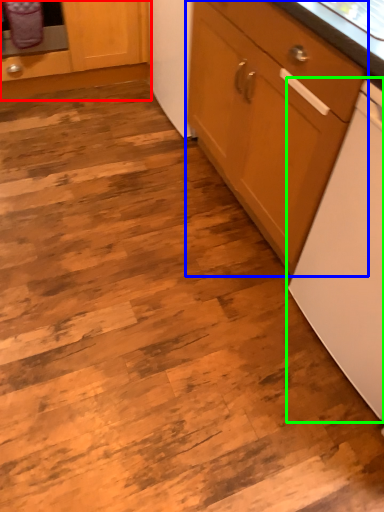
Question: Considering the real-world distances, which object is farthest from cabinetry (highlighted by a red box)? cabinetry (highlighted by a blue box) or home appliance (highlighted by a green box)?

Choices:
 (A) cabinetry
 (B) home appliance

Answer: (B)